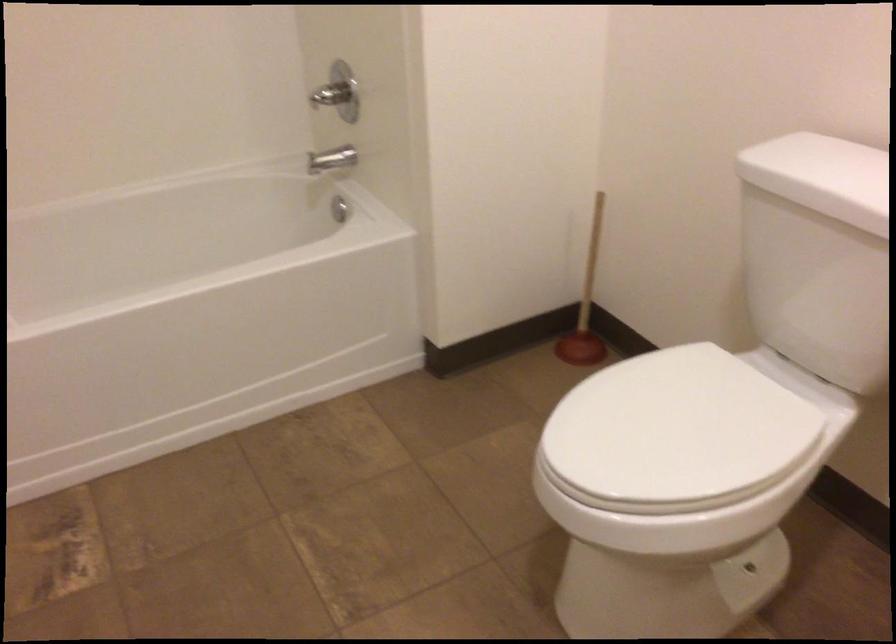
Find the location of `white toilet lid`. white toilet lid is located at coordinates (675, 431).